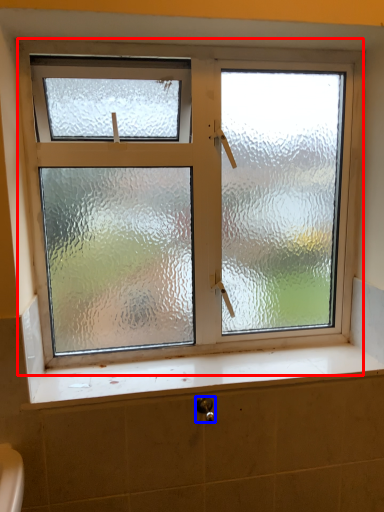
Question: Which object is closer to the camera taking this photo, window (highlighted by a red box) or shower (highlighted by a blue box)?

Choices:
 (A) window
 (B) shower

Answer: (B)